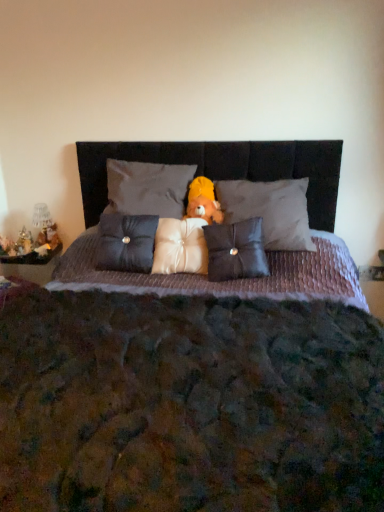
Question: Is satin dark blue pillow at center, the first pillow in the left-to-right sequence, turned away from yellow plush bear at center?

Choices:
 (A) no
 (B) yes

Answer: (A)

Question: Considering the relative sizes of satin dark blue pillow at center, the first pillow in the left-to-right sequence, and yellow plush bear at center in the image provided, is satin dark blue pillow at center, the first pillow in the left-to-right sequence, smaller than yellow plush bear at center?

Choices:
 (A) yes
 (B) no

Answer: (B)

Question: Is satin dark blue pillow at center, marked as the fifth pillow in a right-to-left arrangement, shorter than yellow plush bear at center?

Choices:
 (A) yes
 (B) no

Answer: (B)

Question: Is satin dark blue pillow at center, the first pillow in the left-to-right sequence, wider than yellow plush bear at center?

Choices:
 (A) yes
 (B) no

Answer: (A)

Question: From the image's perspective, is satin dark blue pillow at center, marked as the fifth pillow in a right-to-left arrangement, located above yellow plush bear at center?

Choices:
 (A) no
 (B) yes

Answer: (A)

Question: Is the depth of satin dark blue pillow at center, marked as the fifth pillow in a right-to-left arrangement, greater than that of yellow plush bear at center?

Choices:
 (A) yes
 (B) no

Answer: (B)

Question: From the image's perspective, would you say textured purple quilt at center is positioned over matte black pillow at center, marked as the 4th pillow in a left-to-right arrangement?

Choices:
 (A) no
 (B) yes

Answer: (A)

Question: Is there a large distance between textured purple quilt at center and matte black pillow at center, marked as the 4th pillow in a left-to-right arrangement?

Choices:
 (A) no
 (B) yes

Answer: (A)

Question: Does textured purple quilt at center have a larger size compared to matte black pillow at center, which is counted as the 2th pillow, starting from the right?

Choices:
 (A) yes
 (B) no

Answer: (A)

Question: From the image's perspective, is textured purple quilt at center under matte black pillow at center, marked as the 4th pillow in a left-to-right arrangement?

Choices:
 (A) yes
 (B) no

Answer: (A)

Question: Is textured purple quilt at center next to matte black pillow at center, marked as the 4th pillow in a left-to-right arrangement?

Choices:
 (A) no
 (B) yes

Answer: (A)

Question: Considering the relative sizes of textured purple quilt at center and matte black pillow at center, which is counted as the 2th pillow, starting from the right, in the image provided, is textured purple quilt at center thinner than matte black pillow at center, which is counted as the 2th pillow, starting from the right,?

Choices:
 (A) yes
 (B) no

Answer: (B)

Question: From a real-world perspective, is metallic gold figurine at left, the first figurine from the right, on matte black pillow at center, marked as the 4th pillow in a left-to-right arrangement?

Choices:
 (A) no
 (B) yes

Answer: (A)